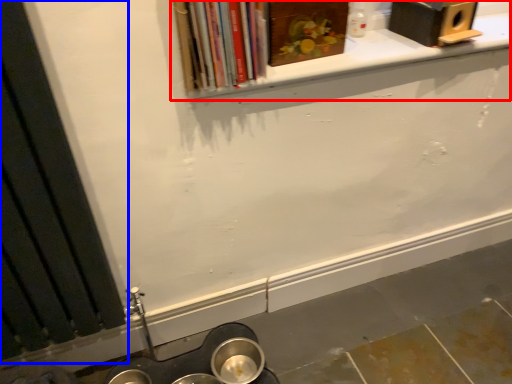
Question: Among these objects, which one is nearest to the camera, window sill (highlighted by a red box) or window frame (highlighted by a blue box)?

Choices:
 (A) window sill
 (B) window frame

Answer: (B)